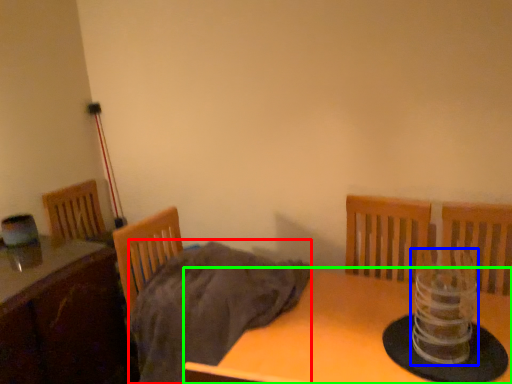
Question: Based on their relative distances, which object is farther from blanket (highlighted by a red box)? Choose from candle holder (highlighted by a blue box) and table (highlighted by a green box).

Choices:
 (A) candle holder
 (B) table

Answer: (A)